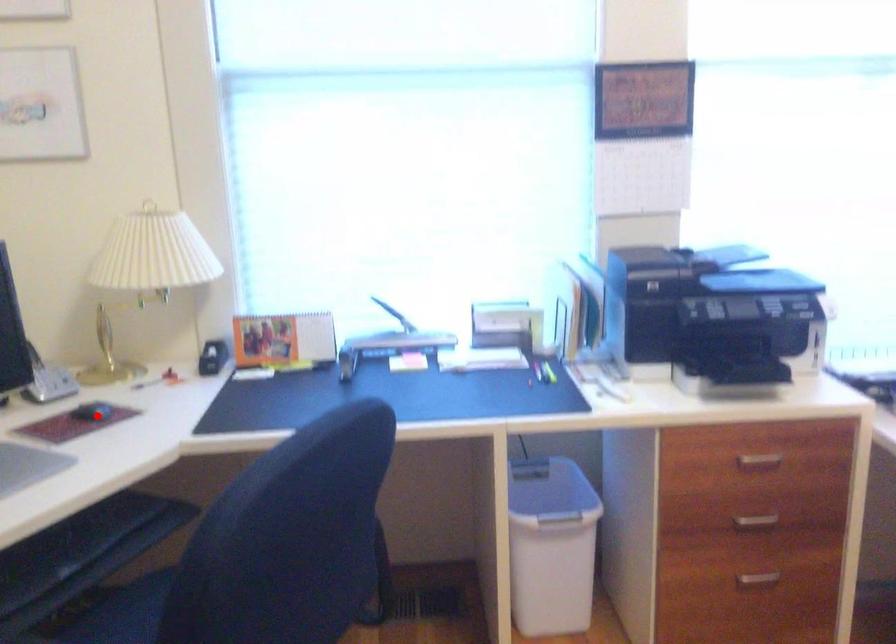
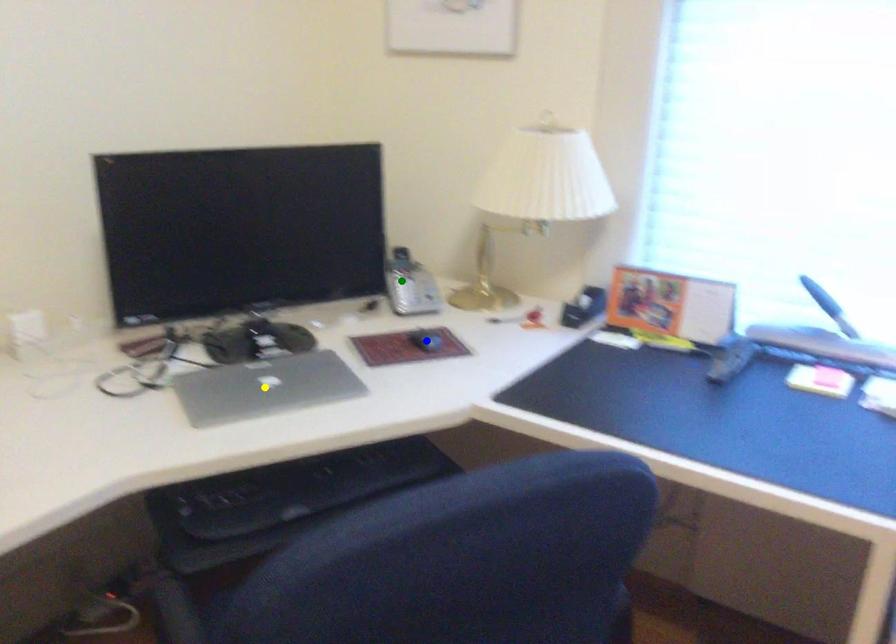
Question: I am providing you with two images of the same scene from different viewpoints. A red point is marked on the first image. You are given multiple points on the second image. Which spot in image 2 lines up with the point in image 1?

Choices:
 (A) yellow point
 (B) blue point
 (C) green point

Answer: (B)